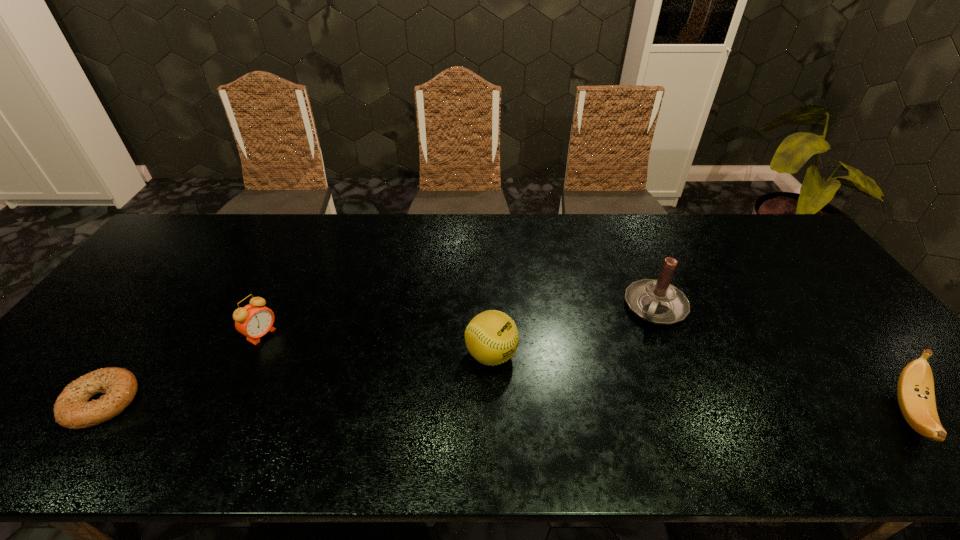
You are a GUI agent. You are given a task and a screenshot of the screen. Output one action in this format:
    pyautogui.click(x=<x>, y=<y>)
    Task: Click on the free region located on the face of the alarm clock
    Image resolution: width=960 pixels, height=540 pixels.
    Given the screenshot: What is the action you would take?
    pyautogui.click(x=344, y=385)

The height and width of the screenshot is (540, 960). Identify the location of free region located 0.060m on the face of the alarm clock. (287, 350).

Find the location of a particular element. This screenshot has height=540, width=960. free space located 0.250m on the face of the alarm clock is located at coordinates (341, 383).

Identify the location of free spot located 0.080m on the logo side of the softball. (541, 383).

Locate an element on the screen. Image resolution: width=960 pixels, height=540 pixels. vacant space located on the logo side of the softball is located at coordinates (x=541, y=383).

At what (x,y) coordinates should I click in order to perform the action: click on free location located on the logo side of the softball. Please return your answer as a coordinate pair (x, y). This screenshot has width=960, height=540. Looking at the image, I should click on (534, 379).

At what (x,y) coordinates should I click in order to perform the action: click on object present at the near edge. Please return your answer as a coordinate pair (x, y). This screenshot has height=540, width=960. Looking at the image, I should click on (72, 410).

This screenshot has width=960, height=540. Find the location of `object that is at the left edge`. object that is at the left edge is located at coordinates (72, 410).

The height and width of the screenshot is (540, 960). Find the location of `object at the near left corner`. object at the near left corner is located at coordinates (72, 410).

Identify the location of vacant area at the far edge. (695, 246).